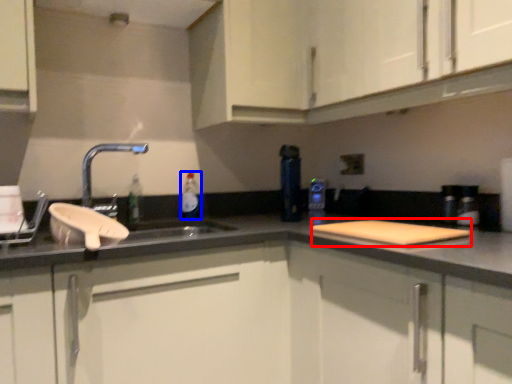
Question: Which point is closer to the camera, cutting board (highlighted by a red box) or bottle (highlighted by a blue box)?

Choices:
 (A) cutting board
 (B) bottle

Answer: (A)